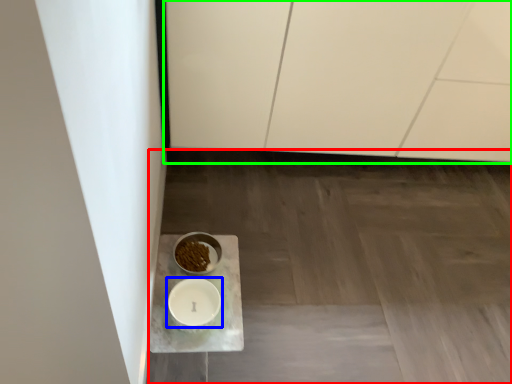
Question: Based on their relative distances, which object is nearer to concrete (highlighted by a red box)? Choose from tableware (highlighted by a blue box) and cabinetry (highlighted by a green box).

Choices:
 (A) tableware
 (B) cabinetry

Answer: (B)